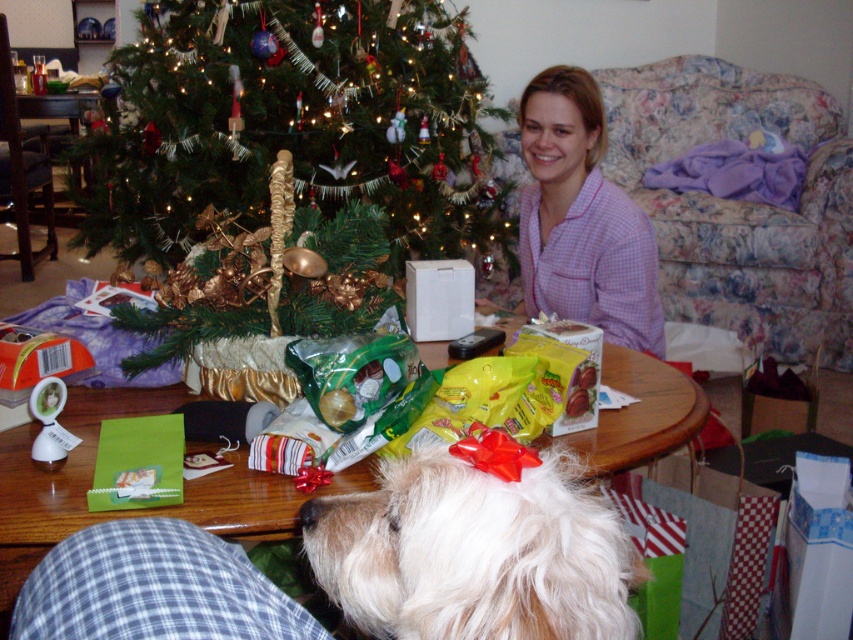
You are standing at the origin point of the room. You want to place a new gift at the wooden table at center. What are the coordinates where you should place the gift?

The wooden table at center is located at coordinates point (x=132, y=509), so you should place the new gift at those coordinates.

You are a guest at a holiday party and want to place a new gift on the wooden table at center. However, you need to ensure it won not block the view of the green matte christmas tree at upper left from the main entrance. Can you do this?

The green matte christmas tree at upper left is positioned over the wooden table at center, meaning it is placed above the table. Since the tree is above the table, placing the gift on the table won will not obstruct the view of the tree from the entrance.